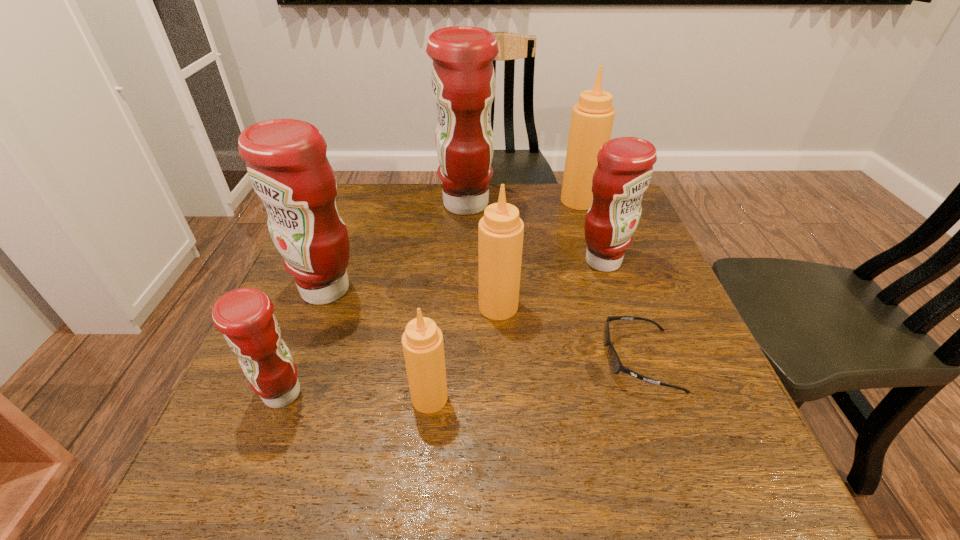
Identify the location of the tallest object. This screenshot has width=960, height=540. (463, 79).

I want to click on the third red condiment from left to right, so click(463, 79).

The height and width of the screenshot is (540, 960). I want to click on the rightmost tan condiment, so click(x=592, y=118).

At what (x,y) coordinates should I click in order to perform the action: click on the biggest tan condiment. Please return your answer as a coordinate pair (x, y). Looking at the image, I should click on (592, 118).

Locate an element on the screen. This screenshot has height=540, width=960. the third smallest red condiment is located at coordinates (286, 161).

The width and height of the screenshot is (960, 540). Find the location of `the second tan condiment from left to right`. the second tan condiment from left to right is located at coordinates (500, 231).

You are a GUI agent. You are given a task and a screenshot of the screen. Output one action in this format:
    pyautogui.click(x=<x>, y=<y>)
    Task: Click on the second smallest tan condiment
    
    Given the screenshot: What is the action you would take?
    pyautogui.click(x=500, y=231)

Where is `the rightmost red condiment`? The height and width of the screenshot is (540, 960). the rightmost red condiment is located at coordinates (625, 164).

Where is `the nearest red condiment`? the nearest red condiment is located at coordinates (244, 316).

The width and height of the screenshot is (960, 540). I want to click on the smallest tan condiment, so click(x=422, y=341).